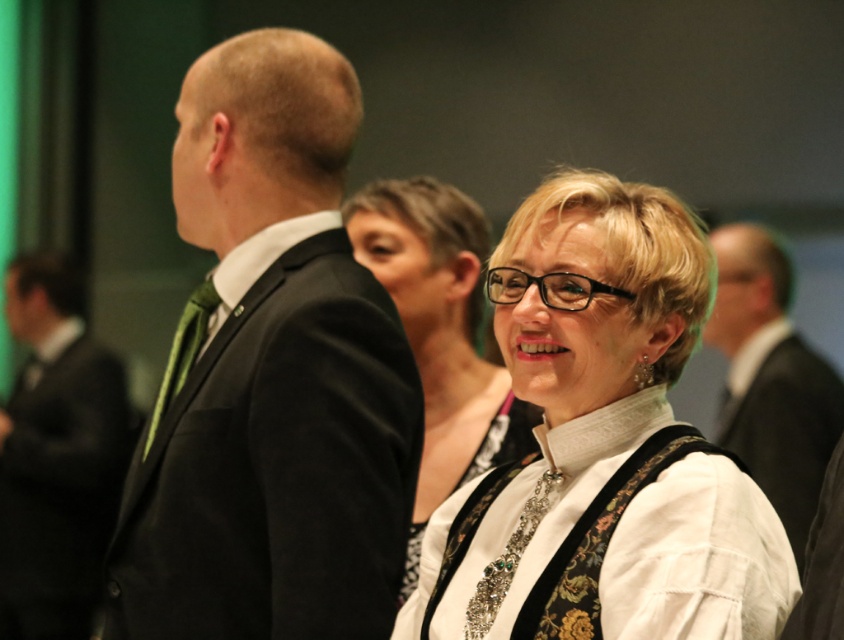
Between point (650, 323) and point (499, 436), which one is positioned in front?

Point (650, 323) is in front.

You are a GUI agent. You are given a task and a screenshot of the screen. Output one action in this format:
    pyautogui.click(x=<x>, y=<y>)
    Task: Click on the white textured blouse at center
    
    Given the screenshot: What is the action you would take?
    pyautogui.click(x=603, y=442)

Who is positioned more to the right, black satin suit at left or white lace dress at center?

From the viewer's perspective, white lace dress at center appears more on the right side.

Is point (309, 164) farther from viewer compared to point (534, 442)?

No, (309, 164) is closer to viewer.

You are a GUI agent. You are given a task and a screenshot of the screen. Output one action in this format:
    pyautogui.click(x=<x>, y=<y>)
    Task: Click on the black satin suit at left
    This screenshot has width=844, height=640.
    Given the screenshot: What is the action you would take?
    pyautogui.click(x=269, y=376)

Is black satin suit at left further to the viewer compared to white lace blouse at center?

No, it is in front of white lace blouse at center.

This screenshot has width=844, height=640. Find the location of `black satin suit at left`. black satin suit at left is located at coordinates (269, 376).